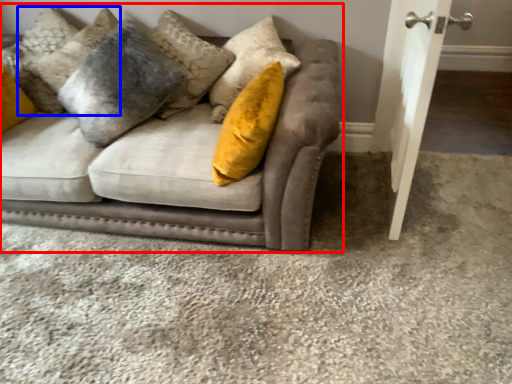
Question: Which object is further to the camera taking this photo, studio couch (highlighted by a red box) or pillow (highlighted by a blue box)?

Choices:
 (A) studio couch
 (B) pillow

Answer: (B)